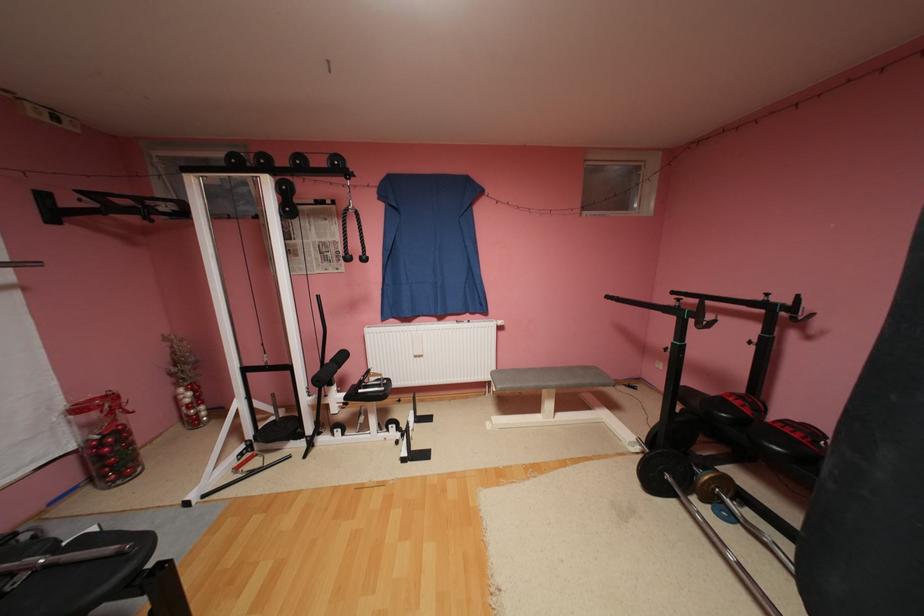
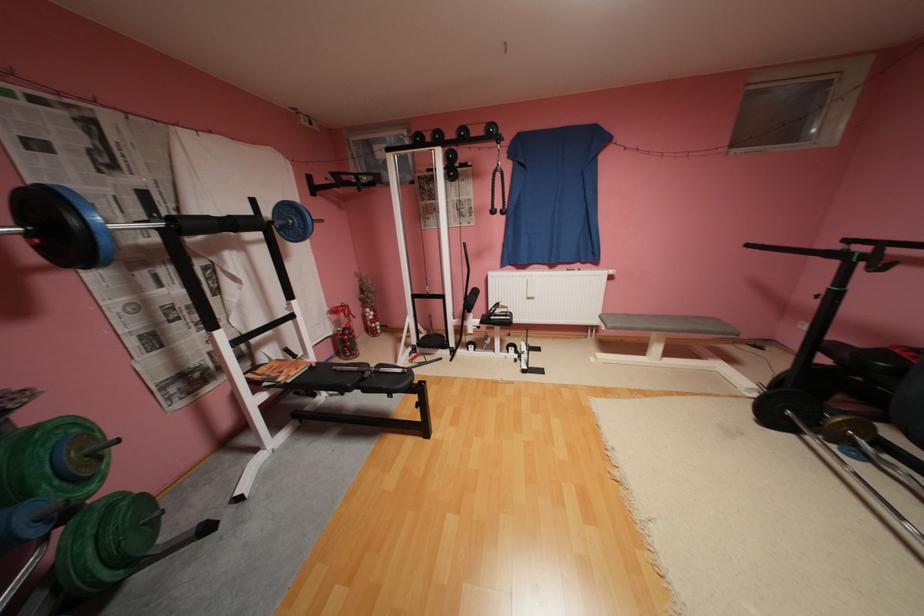
Locate, in the second image, the point that corresponds to point (735, 503) in the first image.

(867, 445)